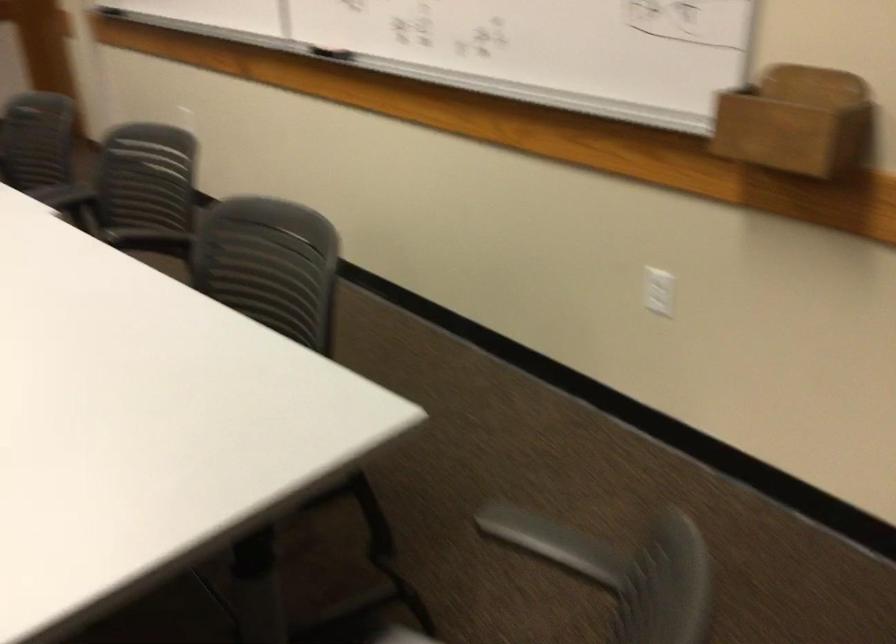
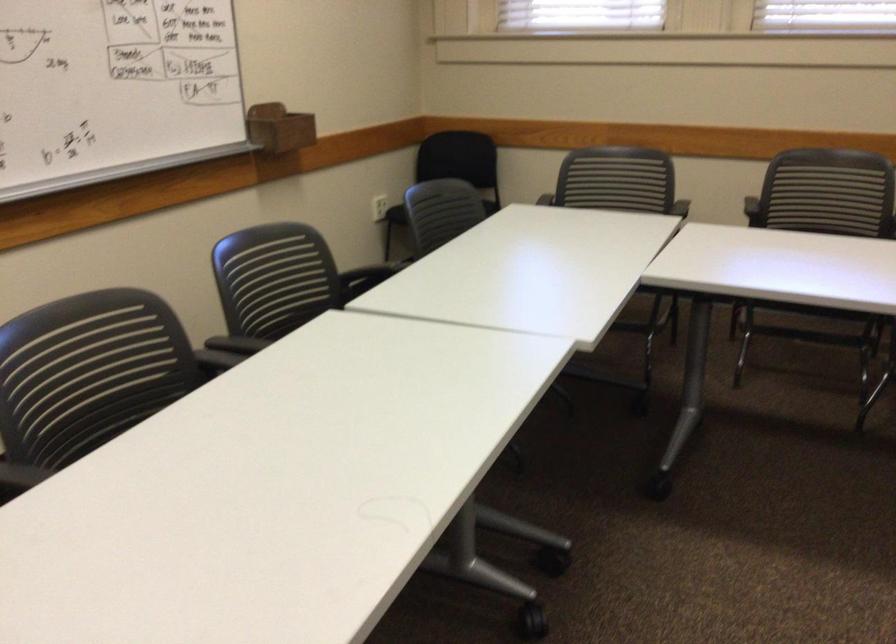
Question: I am providing you with two images of the same scene from different viewpoints. Which of the following objects are not visible in image2?

Choices:
 (A) wooden marker holder
 (B) black chair armrest
 (C) chair sitting surface
 (D) black knob

Answer: (C)